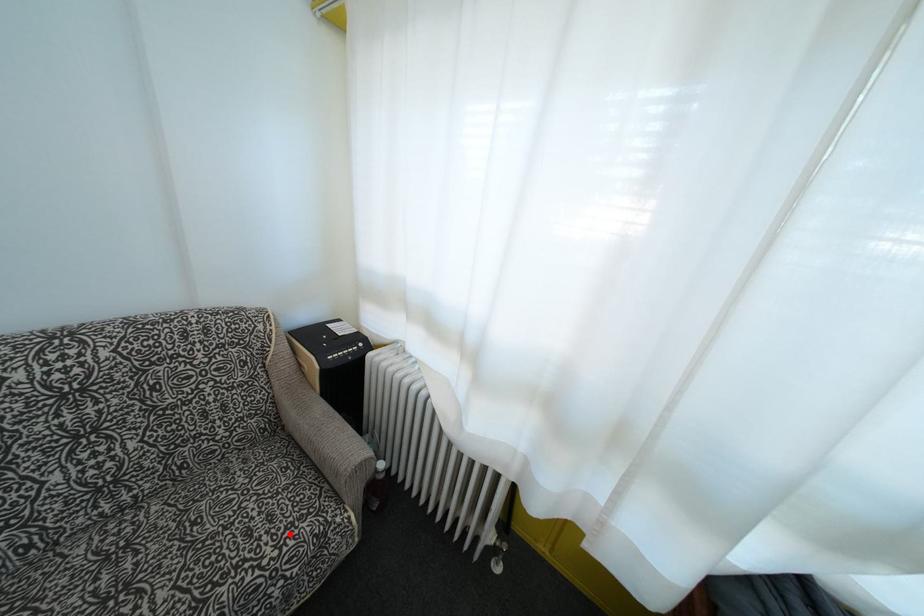
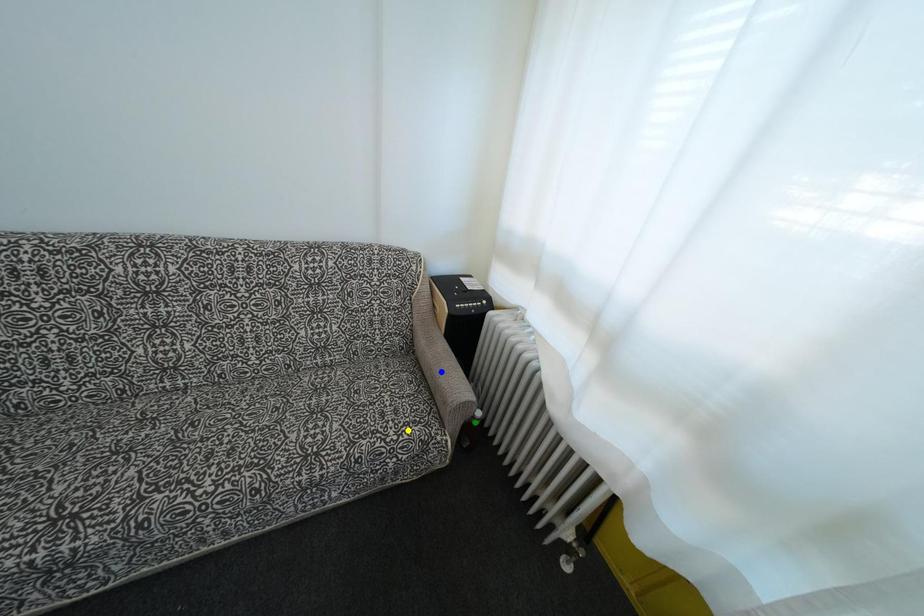
Question: I am providing you with two images of the same scene from different viewpoints. A red point is marked on the first image. You are given multiple points on the second image. Can you choose the point in image 2 that corresponds to the point in image 1?

Choices:
 (A) yellow point
 (B) green point
 (C) blue point

Answer: (A)